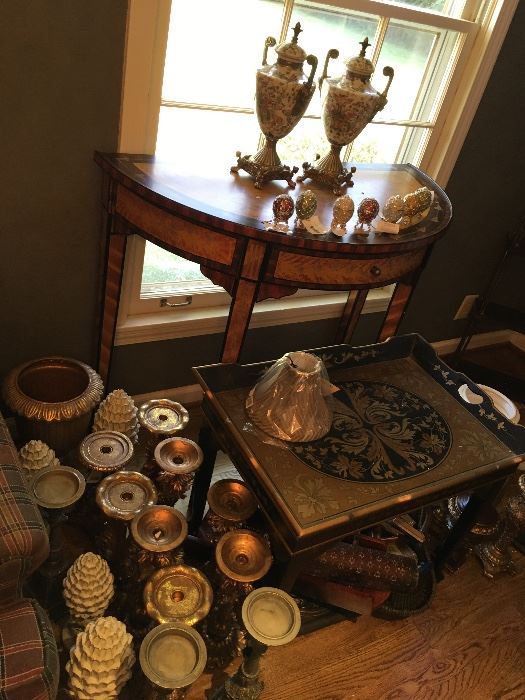
Find the location of a particular element. This screenshot has width=525, height=700. decor is located at coordinates (91, 580).